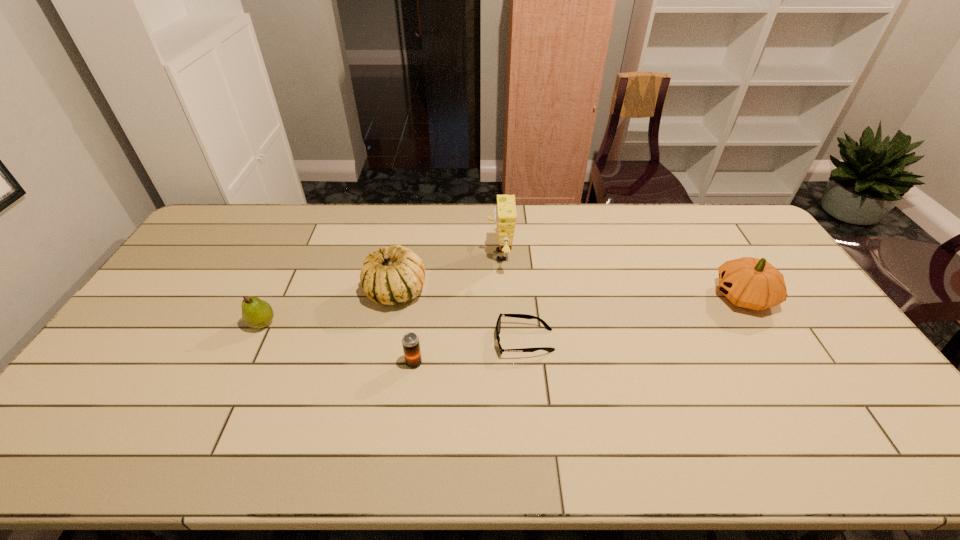
Locate an element on the screen. sponge is located at coordinates (505, 215).

At what (x,y) coordinates should I click in order to perform the action: click on the left gourd. Please return your answer as a coordinate pair (x, y). The height and width of the screenshot is (540, 960). Looking at the image, I should click on (396, 274).

You are a GUI agent. You are given a task and a screenshot of the screen. Output one action in this format:
    pyautogui.click(x=<x>, y=<y>)
    Task: Click on the right gourd
    The height and width of the screenshot is (540, 960).
    Given the screenshot: What is the action you would take?
    pyautogui.click(x=752, y=283)

In order to click on pear in this screenshot , I will do `click(256, 313)`.

The height and width of the screenshot is (540, 960). Identify the location of beer can. pos(410,341).

Find the location of a particular element. The width and height of the screenshot is (960, 540). sunglasses is located at coordinates (498, 325).

You are a GUI agent. You are given a task and a screenshot of the screen. Output one action in this format:
    pyautogui.click(x=<x>, y=<y>)
    Task: Click on the vacant space situated on the front-facing side of the tallest object
    The image size is (960, 540).
    Given the screenshot: What is the action you would take?
    pyautogui.click(x=376, y=255)

Identify the location of free space located 0.350m on the front-facing side of the tallest object. The image size is (960, 540). (385, 255).

What are the coordinates of `vacant region located on the front-facing side of the tallest object` in the screenshot? It's located at (414, 255).

At what (x,y) coordinates should I click in order to perform the action: click on vacant area situated 0.330m on the right of the left gourd. Please return your answer as a coordinate pair (x, y). This screenshot has height=540, width=960. Looking at the image, I should click on (531, 292).